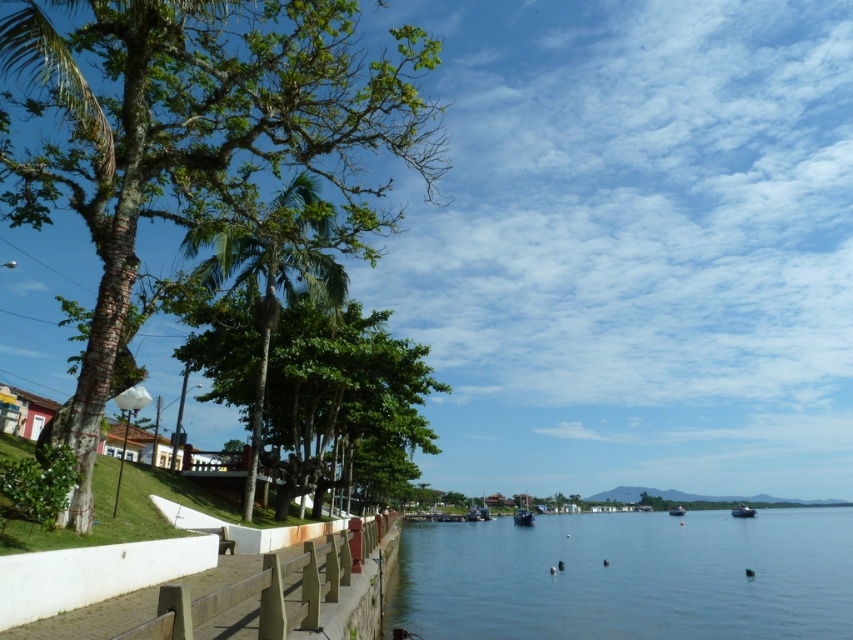
Is smooth bark tree at left wider than clear blue water at lower center?

In fact, smooth bark tree at left might be narrower than clear blue water at lower center.

This screenshot has height=640, width=853. Describe the element at coordinates (192, 136) in the screenshot. I see `smooth bark tree at left` at that location.

Identify the location of smooth bark tree at left. (192, 136).

Can you confirm if clear blue water at lower center is taller than metallic silver boat at lower right?

Correct, clear blue water at lower center is much taller as metallic silver boat at lower right.

Does point (456, 612) come farther from viewer compared to point (747, 506)?

No, (456, 612) is closer to viewer.

Image resolution: width=853 pixels, height=640 pixels. Identify the location of clear blue water at lower center. (628, 577).

Who is more forward, (398, 602) or (384, 490)?

Point (398, 602) is more forward.

Locate an element on the screen. clear blue water at lower center is located at coordinates (628, 577).